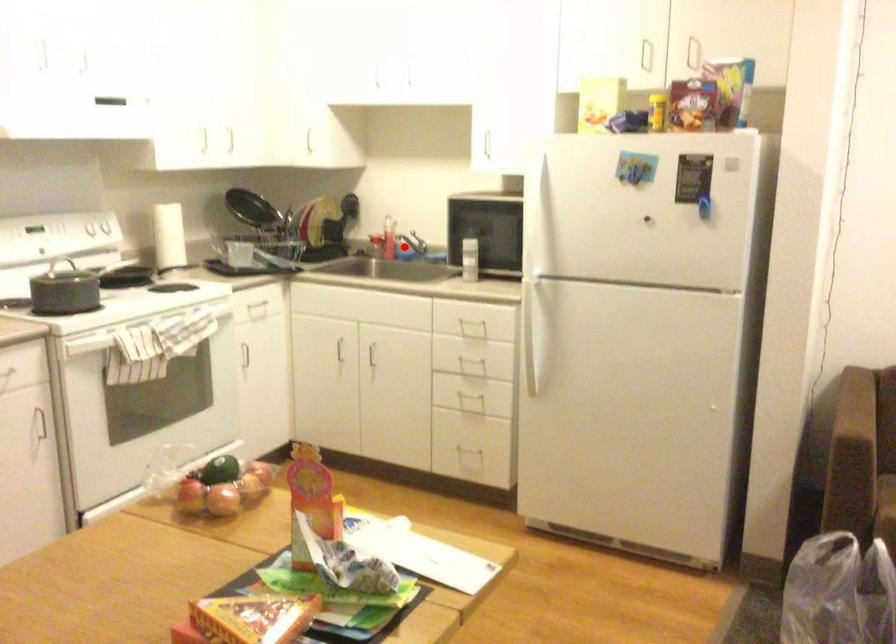
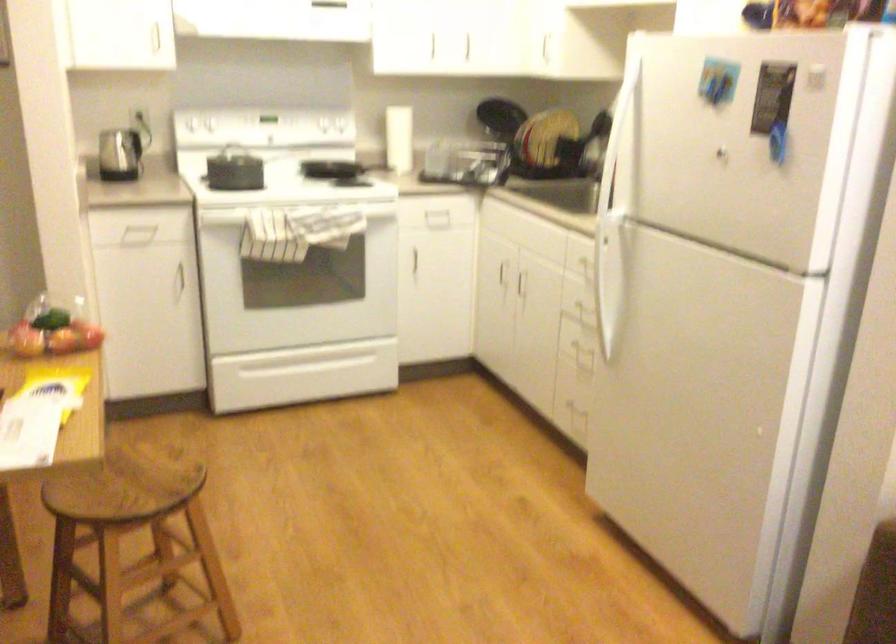
Question: I am providing you with two images of the same scene from different viewpoints. A red point is marked on the first image. At the location where the point appears in image 1, is it still visible in image 2?

Choices:
 (A) Yes
 (B) No

Answer: (B)